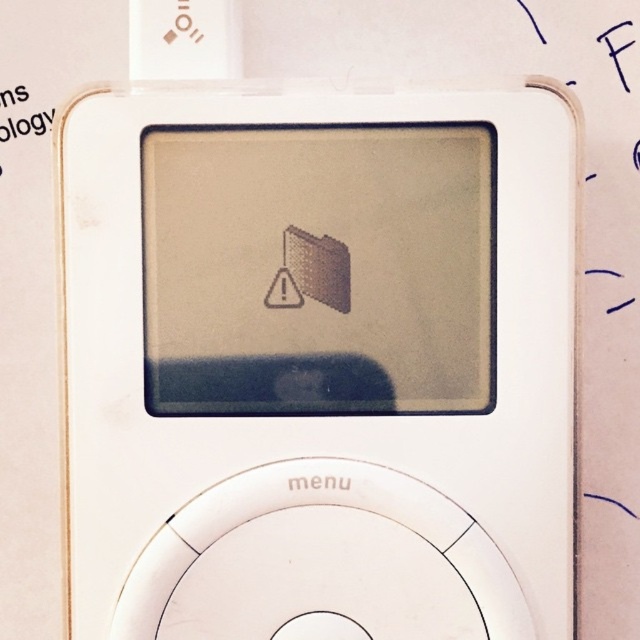
Question: Which object appears farthest from the camera in this image?

Choices:
 (A) black paper at upper left
 (B) white plastic ipod at center

Answer: (A)

Question: Is white plastic ipod at center to the left of black paper at upper left from the viewer's perspective?

Choices:
 (A) no
 (B) yes

Answer: (A)

Question: Which object appears farthest from the camera in this image?

Choices:
 (A) white plastic ipod at center
 (B) black paper at upper left

Answer: (B)

Question: Can you confirm if white plastic ipod at center is positioned below black paper at upper left?

Choices:
 (A) no
 (B) yes

Answer: (B)

Question: Is the position of white plastic ipod at center more distant than that of black paper at upper left?

Choices:
 (A) yes
 (B) no

Answer: (B)

Question: Which of the following is the farthest from the observer?

Choices:
 (A) (372, 280)
 (B) (44, 122)

Answer: (B)